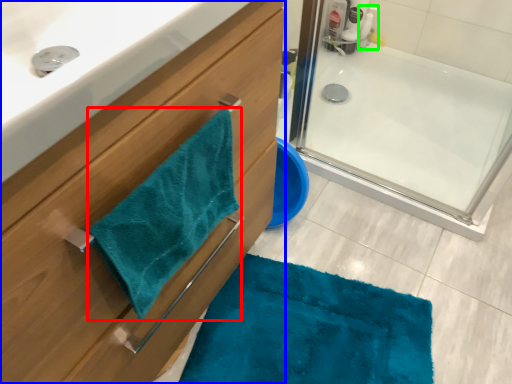
Question: Which object is the closest to the beach towel (highlighted by a red box)? Choose among these: bathroom cabinet (highlighted by a blue box) or cleaning product (highlighted by a green box).

Choices:
 (A) bathroom cabinet
 (B) cleaning product

Answer: (A)